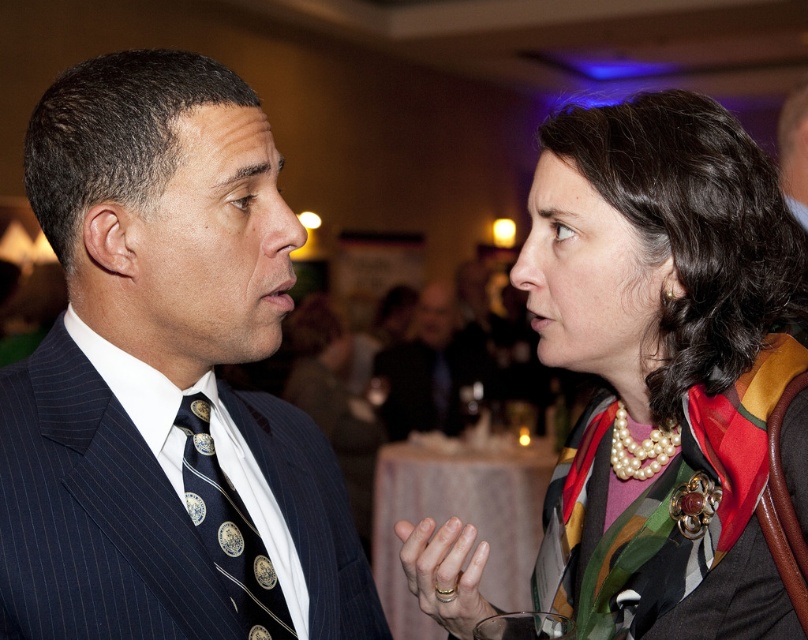
You are a photographer at a formal event. You want to capture a closeup shot of the dark blue pinstripe suit at center and the navy silk tie at center in the same frame. Can you fit both in a 5 inch wide camera frame?

The dark blue pinstripe suit at center and navy silk tie at center are 4.63 inches apart. Since the distance between them is less than the 5 inch width of the camera frame, both can be captured in the same closeup shot.

You are taking a photo of the two people in the scene. You want to focus on the person closer to the camera. Which point should you focus on, point (646,346) or point (386,348)?

Point (646,346) is closer to the camera than point (386,348), so you should focus on point (646,346).